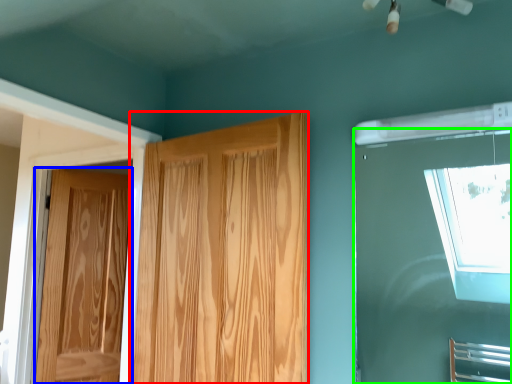
Question: Which object is the farthest from door (highlighted by a red box)? Choose among these: door (highlighted by a blue box) or window (highlighted by a green box).

Choices:
 (A) door
 (B) window

Answer: (B)